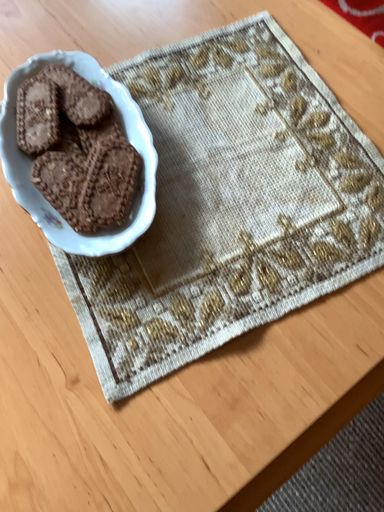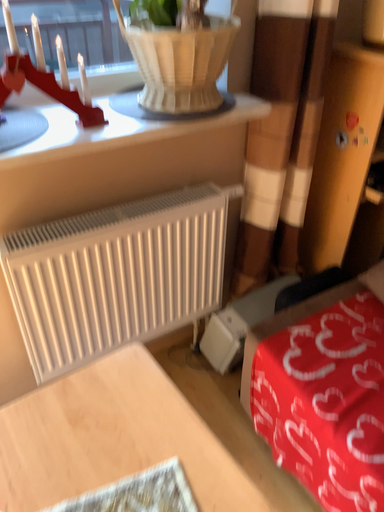
Question: How did the camera likely rotate when shooting the video?

Choices:
 (A) rotated upward
 (B) rotated downward

Answer: (A)